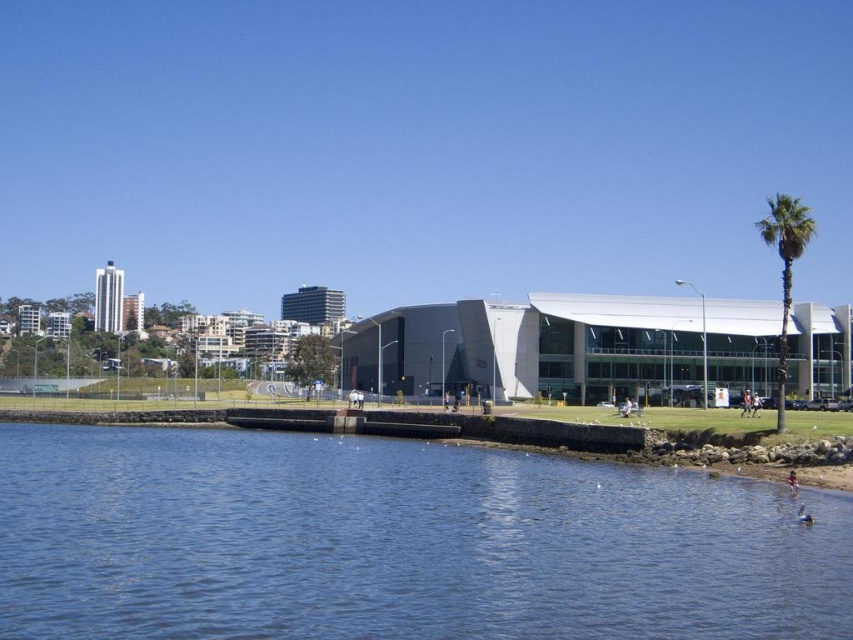
Question: Among these points, which one is farthest from the camera?

Choices:
 (A) (363, 612)
 (B) (805, 244)

Answer: (B)

Question: Among these points, which one is nearest to the camera?

Choices:
 (A) (763, 241)
 (B) (318, 525)

Answer: (B)

Question: Which of the following is the closest to the observer?

Choices:
 (A) green leafy palm tree at right
 (B) blue water at lower left

Answer: (B)

Question: Is blue water at lower left smaller than green leafy palm tree at right?

Choices:
 (A) yes
 (B) no

Answer: (A)

Question: Is blue water at lower left bigger than green leafy palm tree at right?

Choices:
 (A) yes
 (B) no

Answer: (B)

Question: Considering the relative positions of blue water at lower left and green leafy palm tree at right in the image provided, where is blue water at lower left located with respect to green leafy palm tree at right?

Choices:
 (A) right
 (B) left

Answer: (B)